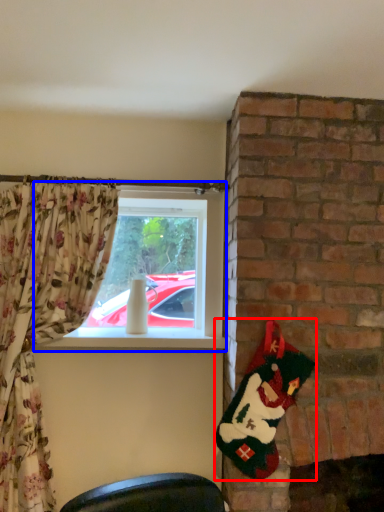
Question: Which object is closer to the camera taking this photo, santa claus (highlighted by a red box) or window (highlighted by a blue box)?

Choices:
 (A) santa claus
 (B) window

Answer: (A)